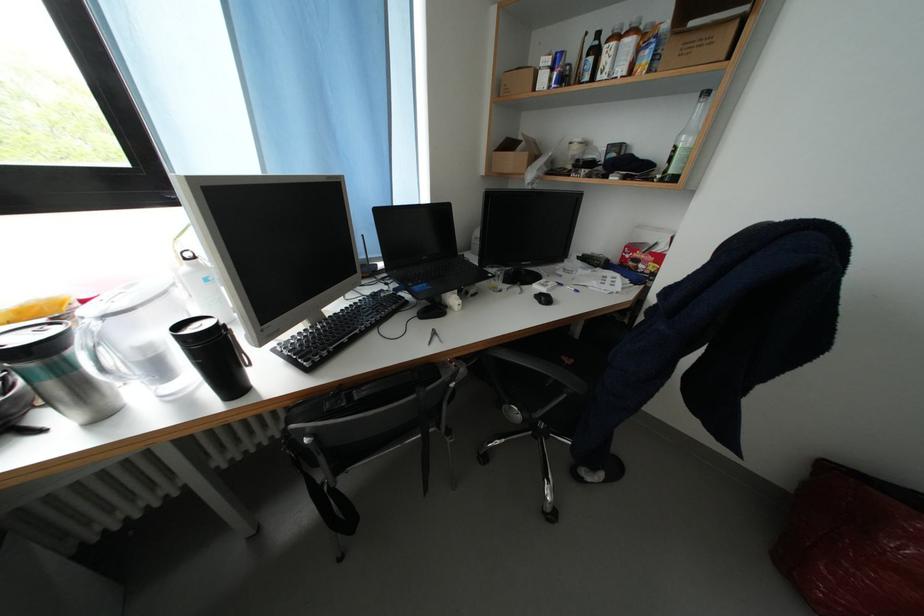
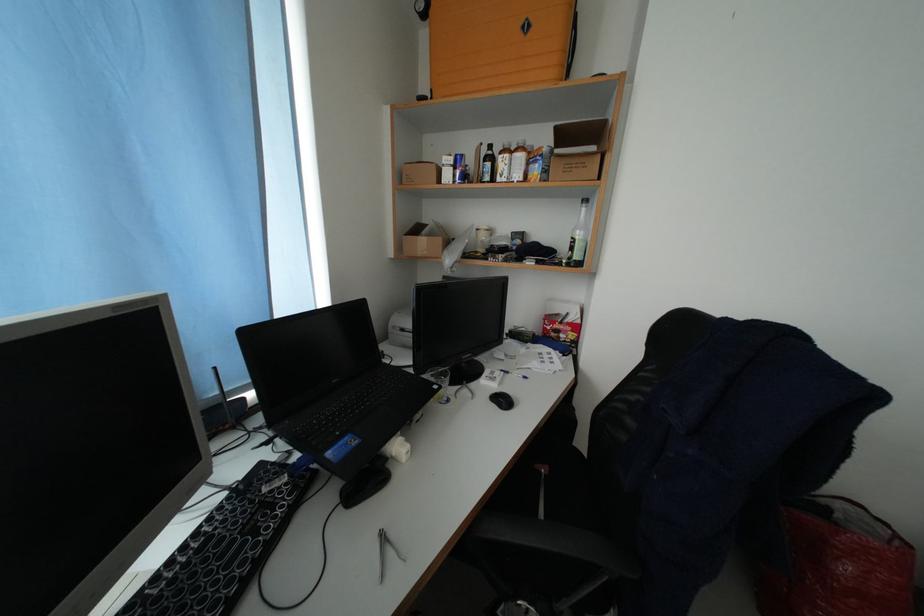
Locate, in the second image, the point that corresponds to (x=678, y=53) in the first image.

(563, 169)